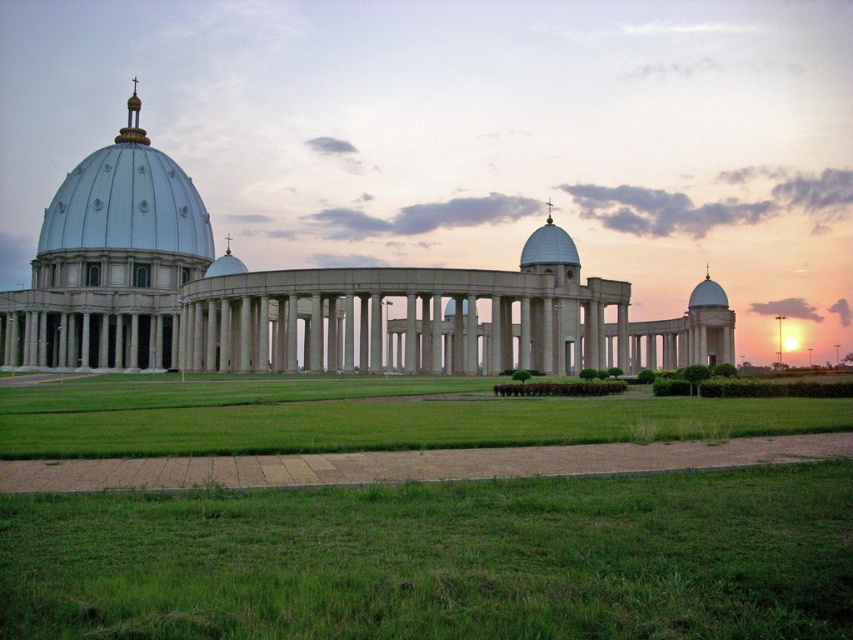
The image size is (853, 640). Describe the element at coordinates (300, 298) in the screenshot. I see `white marble building at center` at that location.

Can you confirm if white marble building at center is positioned above metallic silver dome at upper left?

No, white marble building at center is not above metallic silver dome at upper left.

The width and height of the screenshot is (853, 640). What do you see at coordinates (300, 298) in the screenshot?
I see `white marble building at center` at bounding box center [300, 298].

Image resolution: width=853 pixels, height=640 pixels. In order to click on white marble building at center in this screenshot , I will do `click(300, 298)`.

Is green grass at center thinner than white glossy dome at center?

In fact, green grass at center might be wider than white glossy dome at center.

Between green grass at center and white glossy dome at center, which one has more height?

With more height is green grass at center.

What do you see at coordinates (361, 417) in the screenshot? I see `green grass at center` at bounding box center [361, 417].

Where is `green grass at center`? green grass at center is located at coordinates (361, 417).

Between white marble building at center and green grass at center, which one appears on the right side from the viewer's perspective?

green grass at center

Can you confirm if white marble building at center is thinner than green grass at center?

No.

Which is in front, point (175, 308) or point (241, 429)?

Positioned in front is point (241, 429).

Locate an element on the screen. white marble building at center is located at coordinates (300, 298).